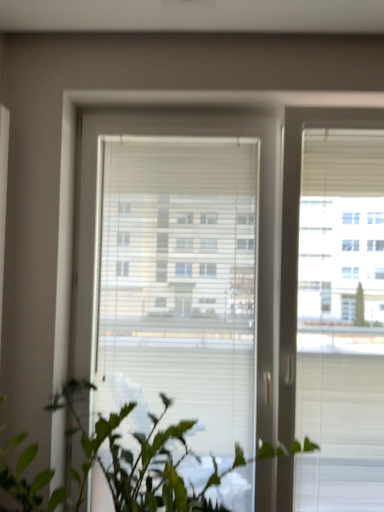
The image size is (384, 512). Describe the element at coordinates (183, 274) in the screenshot. I see `white plastic window at center` at that location.

The image size is (384, 512). I want to click on white plastic window at center, so click(x=183, y=274).

Locate an element on the screen. The image size is (384, 512). green matte plant at lower left is located at coordinates (126, 463).

The width and height of the screenshot is (384, 512). What do you see at coordinates (126, 463) in the screenshot?
I see `green matte plant at lower left` at bounding box center [126, 463].

I want to click on white plastic window at center, so click(x=183, y=274).

Which is more to the left, green matte plant at lower left or white plastic window at center?

From the viewer's perspective, green matte plant at lower left appears more on the left side.

Is green matte plant at lower left in front of or behind white plastic window at center in the image?

Clearly, green matte plant at lower left is in front of white plastic window at center.

Which is behind, point (117, 498) or point (154, 397)?

The point (154, 397) is farther.

From the image's perspective, who appears lower, green matte plant at lower left or white plastic window at center?

green matte plant at lower left, from the image's perspective.

From a real-world perspective, is green matte plant at lower left above or below white plastic window at center?

green matte plant at lower left is situated lower than white plastic window at center in the real world.

Considering the sizes of objects green matte plant at lower left and white plastic window at center in the image provided, who is thinner, green matte plant at lower left or white plastic window at center?

With smaller width is white plastic window at center.

From their relative heights in the image, would you say green matte plant at lower left is taller or shorter than white plastic window at center?

green matte plant at lower left is shorter than white plastic window at center.

Considering the relative sizes of green matte plant at lower left and white plastic window at center in the image provided, is green matte plant at lower left bigger than white plastic window at center?

Indeed, green matte plant at lower left has a larger size compared to white plastic window at center.

Is green matte plant at lower left situated inside white plastic window at center or outside?

green matte plant at lower left is located beyond the bounds of white plastic window at center.

Is green matte plant at lower left far away from white plastic window at center?

That's not correct — green matte plant at lower left is a little close to white plastic window at center.

Is green matte plant at lower left turned away from white plastic window at center?

Yes, green matte plant at lower left's orientation is away from white plastic window at center.

Measure the distance between green matte plant at lower left and white plastic window at center.

16.18 inches.

Find the location of a particular element. houseplant on the left of white plastic window at center is located at coordinates (126, 463).

Which object is positioned more to the right, white plastic window at center or green matte plant at lower left?

white plastic window at center.

Is white plastic window at center further to the viewer compared to green matte plant at lower left?

Yes, the depth of white plastic window at center is greater than that of green matte plant at lower left.

Is point (168, 228) positioned before point (160, 486)?

No, (168, 228) is behind (160, 486).

From the image's perspective, is white plastic window at center located above or below green matte plant at lower left?

white plastic window at center is above green matte plant at lower left.

From a real-world perspective, relative to green matte plant at lower left, is white plastic window at center vertically above or below?

From a real-world perspective, white plastic window at center is physically above green matte plant at lower left.

Can you confirm if white plastic window at center is thinner than green matte plant at lower left?

Indeed, white plastic window at center has a lesser width compared to green matte plant at lower left.

In terms of height, does white plastic window at center look taller or shorter compared to green matte plant at lower left?

Considering their sizes, white plastic window at center has more height than green matte plant at lower left.

Considering the relative sizes of white plastic window at center and green matte plant at lower left in the image provided, is white plastic window at center smaller than green matte plant at lower left?

Yes, white plastic window at center is smaller than green matte plant at lower left.

Can we say white plastic window at center lies outside green matte plant at lower left?

white plastic window at center lies outside green matte plant at lower left's area.

Are white plastic window at center and green matte plant at lower left located far from each other?

No, white plastic window at center is not far from green matte plant at lower left.

Is white plastic window at center facing away from green matte plant at lower left?

Yes.

Can you tell me how much white plastic window at center and green matte plant at lower left differ in facing direction?

There is a 0.000177-degree angle between the facing directions of white plastic window at center and green matte plant at lower left.

In the scene shown: How distant is white plastic window at center from green matte plant at lower left?

white plastic window at center and green matte plant at lower left are 16.18 inches apart.

Identify the location of window above the green matte plant at lower left (from a real-world perspective). (183, 274).

The image size is (384, 512). What are the coordinates of `window on the right of the green matte plant at lower left` in the screenshot? It's located at (183, 274).

Where is `houseplant below the white plastic window at center (from the image's perspective)`? Image resolution: width=384 pixels, height=512 pixels. houseplant below the white plastic window at center (from the image's perspective) is located at coordinates click(x=126, y=463).